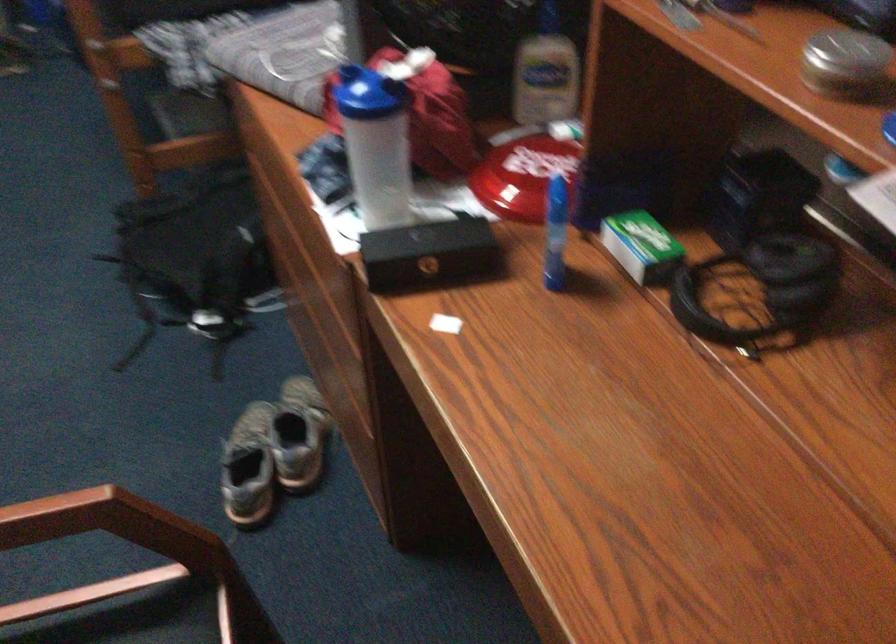
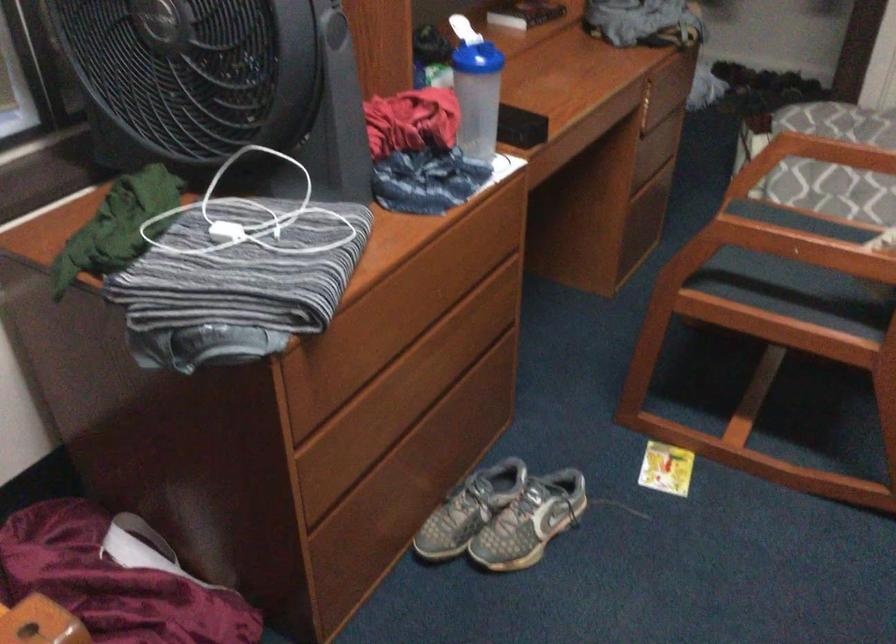
Where in the second image is the point corresponding to pixel 425 84 from the first image?

(462, 29)